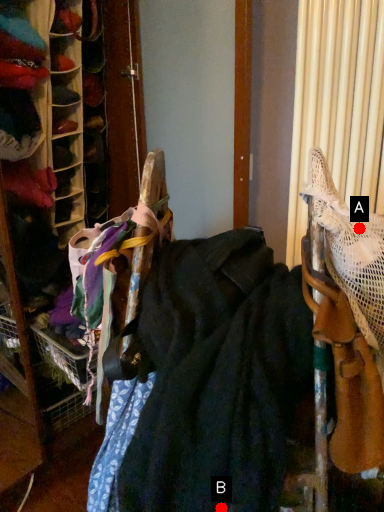
Question: Two points are circled on the image, labeled by A and B beside each circle. Which point is closer to the camera taking this photo?

Choices:
 (A) A is closer
 (B) B is closer

Answer: (B)